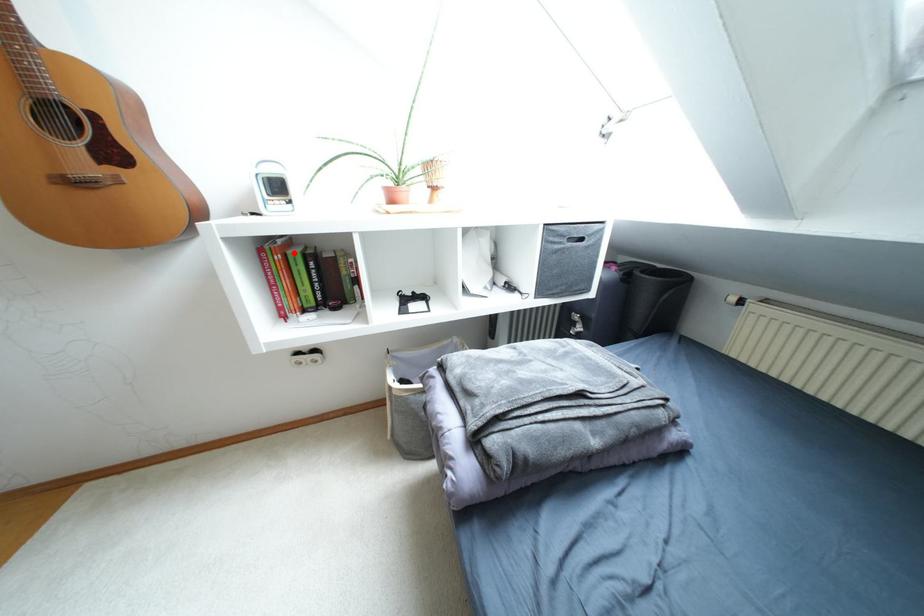
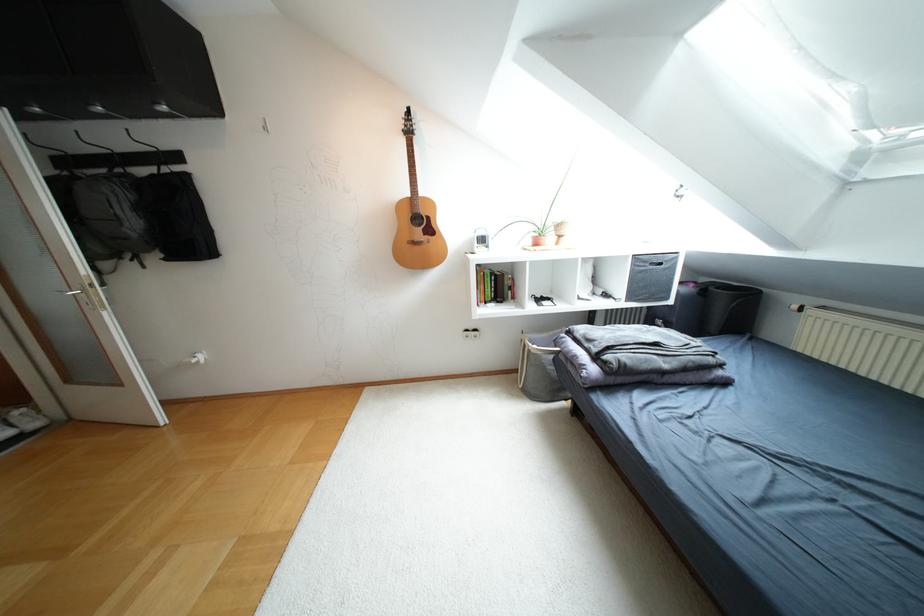
Where in the second image is the point corresponding to the highlighted location from the first image?

(487, 272)